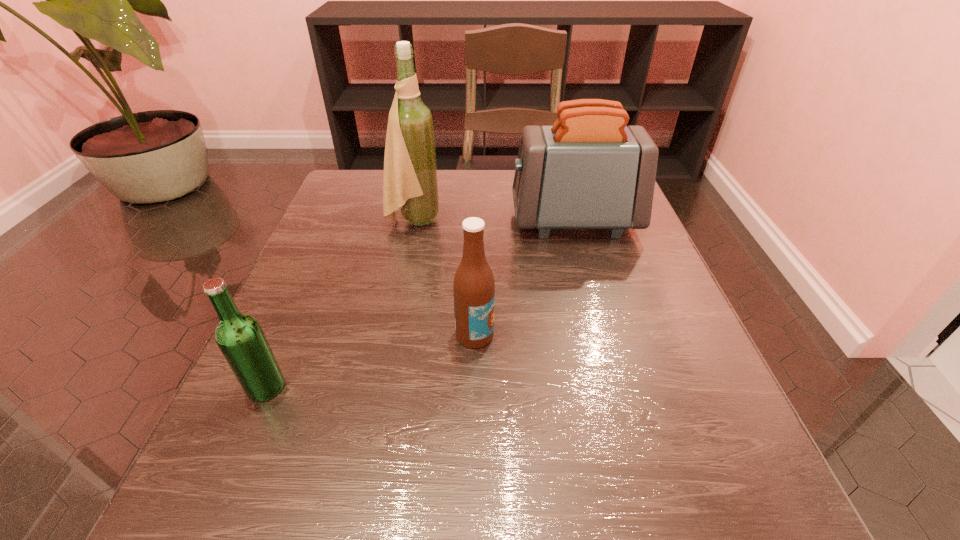
Image resolution: width=960 pixels, height=540 pixels. What are the coordinates of `free space that is in between the rightmost object and the wine bottle` in the screenshot? It's located at (494, 221).

At what (x,y) coordinates should I click in order to perform the action: click on free spot between the nearer beer bottle and the tallest object. Please return your answer as a coordinate pair (x, y). This screenshot has width=960, height=540. Looking at the image, I should click on (340, 304).

Find the location of a particular element. The width and height of the screenshot is (960, 540). vacant space that is in between the nearer beer bottle and the second object from left to right is located at coordinates (340, 304).

Where is `vacant area that lies between the tallest object and the rightmost object`? The image size is (960, 540). vacant area that lies between the tallest object and the rightmost object is located at coordinates (494, 221).

Locate an element on the screen. Image resolution: width=960 pixels, height=540 pixels. the second closest object to the farther beer bottle is located at coordinates click(410, 183).

The image size is (960, 540). I want to click on object that ranks as the closest to the farther beer bottle, so click(x=589, y=170).

Find the location of a particular element. vacant area that satisfies the following two spatial constraints: 1. on the front-facing side of the second object from left to right; 2. on the left side of the third object from left to right is located at coordinates (391, 334).

This screenshot has height=540, width=960. Identify the location of vacant space that satisfies the following two spatial constraints: 1. on the back side of the third object from left to right; 2. on the front-facing side of the third object from right to left. (476, 221).

This screenshot has width=960, height=540. I want to click on free space that satisfies the following two spatial constraints: 1. on the front-facing side of the wine bottle; 2. on the left side of the second nearest object, so click(391, 334).

Locate an element on the screen. vacant space that satisfies the following two spatial constraints: 1. on the front-facing side of the wine bottle; 2. on the front side of the nearest object is located at coordinates (380, 387).